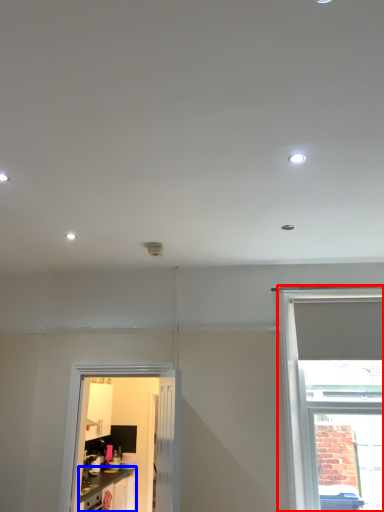
Question: Which object is further to the camera taking this photo, window (highlighted by a red box) or cabinetry (highlighted by a blue box)?

Choices:
 (A) window
 (B) cabinetry

Answer: (B)